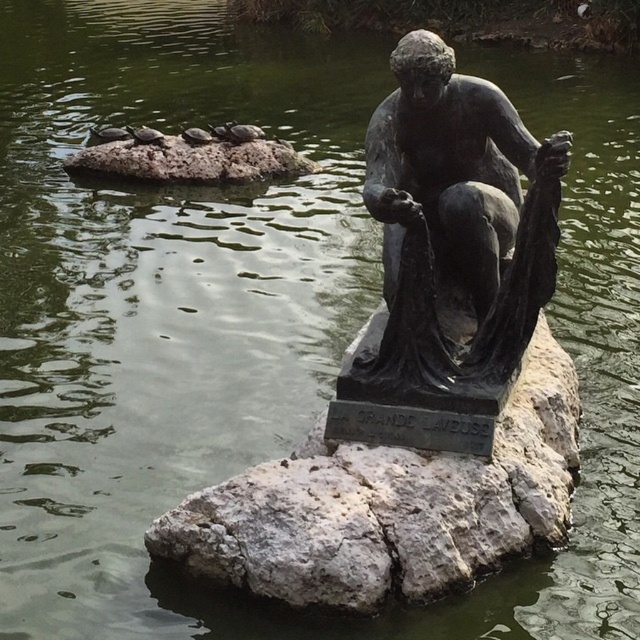
You are a landscape architect designing a pathway around the bronze statue. You need to know the relationship between the gray stone at center and the gray rock at upper center to ensure proper drainage. Can you describe their spatial arrangement?

The gray stone at center is positioned under the gray rock at upper center, meaning the gray stone at center supports the gray rock at upper center, which is elevated above it. This suggests that water would naturally flow downward from the gray rock at upper center onto the gray stone at center, so the pathway should be designed to channel water away from these structures to prevent pooling.

You are a sculptor standing on the gray stone at center, looking towards the gray rock at upper center. Which object is closer to your current position?

The gray rock at upper center is closer to your current position on the gray stone at center because the gray stone at center is taller than the gray rock at upper center, implying proximity.

You are an artist planning to paint the statue and its surroundings. You need to decide which of the two gray objects, the gray stone at center or the gray rock at upper center, requires less detail in your painting because it is smaller in width. Which one should you choose?

The gray stone at center is thinner than the gray rock at upper center, so you should choose the gray stone at center for less detail because it is smaller in width.